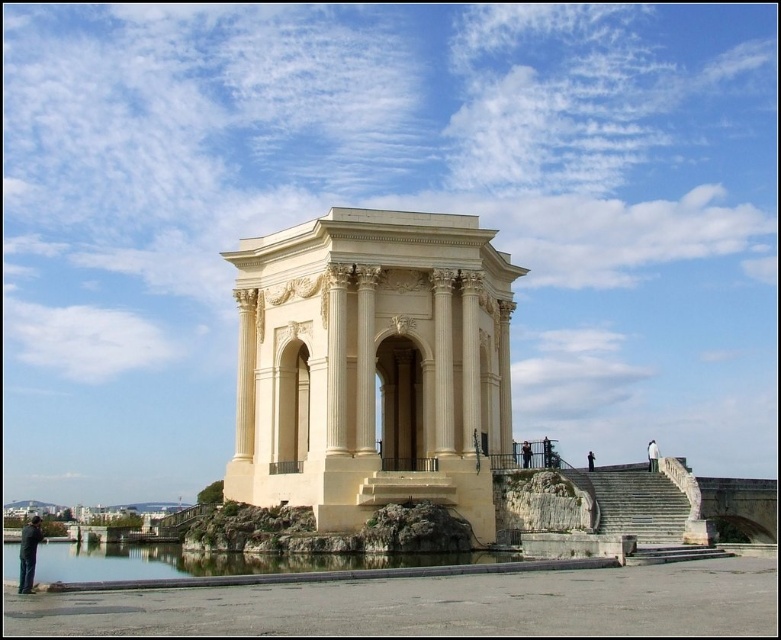
You are standing in the plaza and want to take a photo of both the white marble monument at center and the black fabric person at center. Which object should you focus on first to ensure both are in frame?

You should focus on the white marble monument at center first because it is wider than the black fabric person at center, so positioning the camera to accommodate its larger size will ensure both fit in the frame.

Looking at this image, you are standing in the plaza and see the white marble monument at center and the black fabric person at center. Which object is closer to you?

The white marble monument at center is closer to you because it is in front of the black fabric person at center.

You are a photographer setting up a tripod in the plaza. You need to position it between the black leather pants at lower left and the white stone person at right. Can you fit the tripod between them if the tripod requires at least 1 meter of space?

The black leather pants at lower left is wider than the white stone person at right, but the question is about the space between them. The description only provides their widths, not the distance between them. Without knowing the distance between the two objects, it is impossible to determine if the tripod can fit.